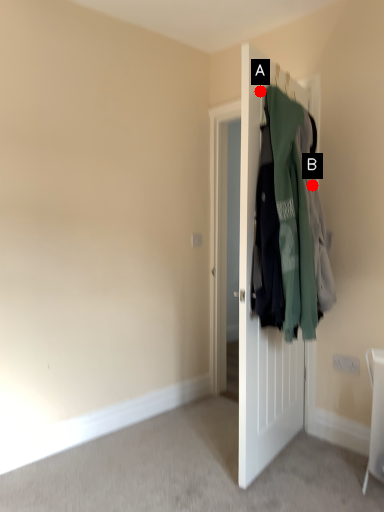
Question: Two points are circled on the image, labeled by A and B beside each circle. Which point is closer to the camera taking this photo?

Choices:
 (A) A is closer
 (B) B is closer

Answer: (A)